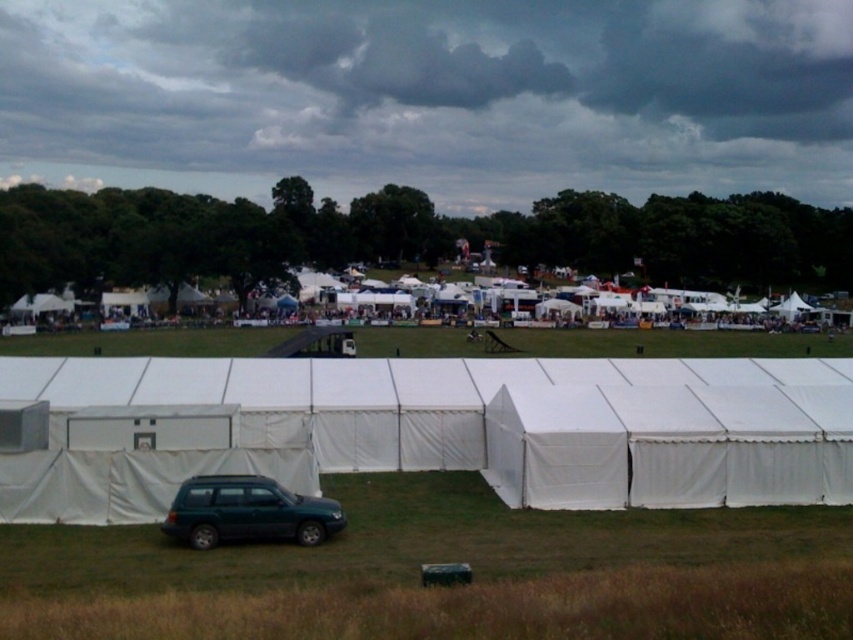
You are planning to set up a small garden in the area shown in the image. Considering the white fabric tent at lower center and the green grass at center, which one is taller and would cast a shadow over the other during the day?

The white fabric tent at lower center is much taller than the green grass at center, so it would cast a shadow over the green grass at center during the day.

You are planning to set up a picnic and need to choose between the white fabric tent at lower center and the green grass at center. Which location offers more space for spreading out a picnic blanket?

The green grass at center offers more space for spreading out a picnic blanket because the white fabric tent at lower center is smaller in size compared to the green grass at center.

You are standing at point (378, 422) and want to walk to the entrance of the large white tent. The path is straight and unobstructed. If your walking speed is 1.5 meters per second, how many seconds will it take you to reach the entrance?

The distance between you and the entrance of the large white tent is 34.17 meters. At a walking speed of 1.5 meters per second, it will take approximately 22.78 seconds to reach the entrance.